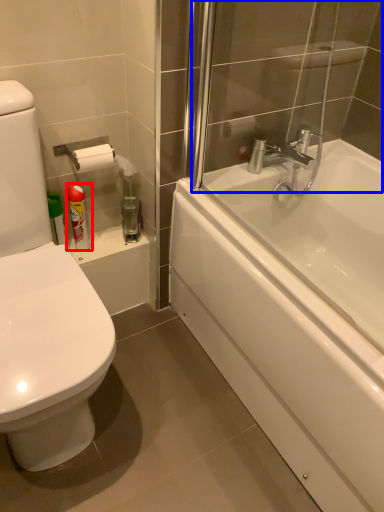
Question: Which object appears farthest to the camera in this image, toiletry (highlighted by a red box) or shower door (highlighted by a blue box)?

Choices:
 (A) toiletry
 (B) shower door

Answer: (A)